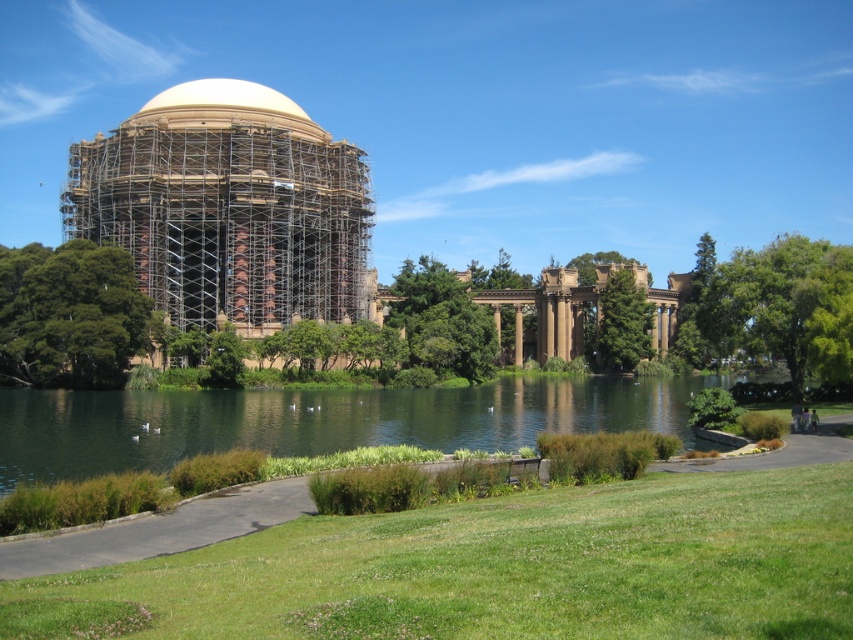
You are a visitor standing on the grassy area in front of the park. You want to take a photo of the white textured dome at upper center without the brown stone columns at center blocking the view. Is this possible?

The brown stone columns at center are located below the white textured dome at upper center, so you can take a photo of the white textured dome at upper center without the brown stone columns at center blocking the view by angling the camera upwards to avoid the columns.

You are planning to place a 3m wide picnic blanket in the park. You see the green grassy water at lower center and the brown stone columns at center. Which area can accommodate your picnic blanket without overlapping any objects?

The green grassy water at lower center has a larger width than the brown stone columns at center, so the picnic blanket can be placed on the green grassy water at lower center as it has enough space.

You are a landscape architect planning to install a new bench in the park. You want to place it where it can be seen from both the green grassy water at lower center and the brown stone columns at center. Considering their heights, which object will the bench be closer to?

The bench should be placed closer to the green grassy water at lower center because it has a lesser height compared to the brown stone columns at center, allowing for better visibility from both locations.